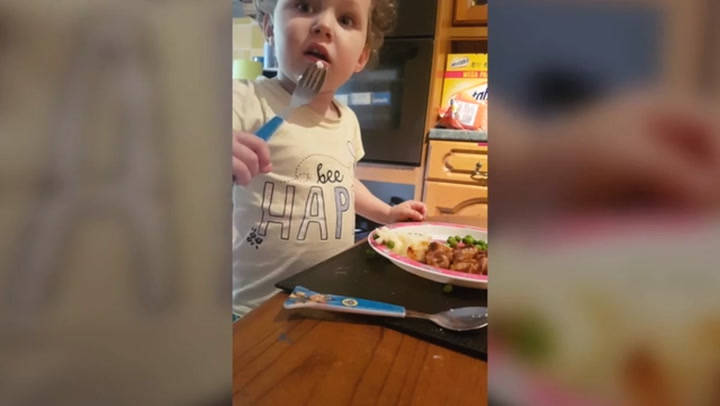
Where is `spoon`? The height and width of the screenshot is (406, 720). spoon is located at coordinates click(462, 318).